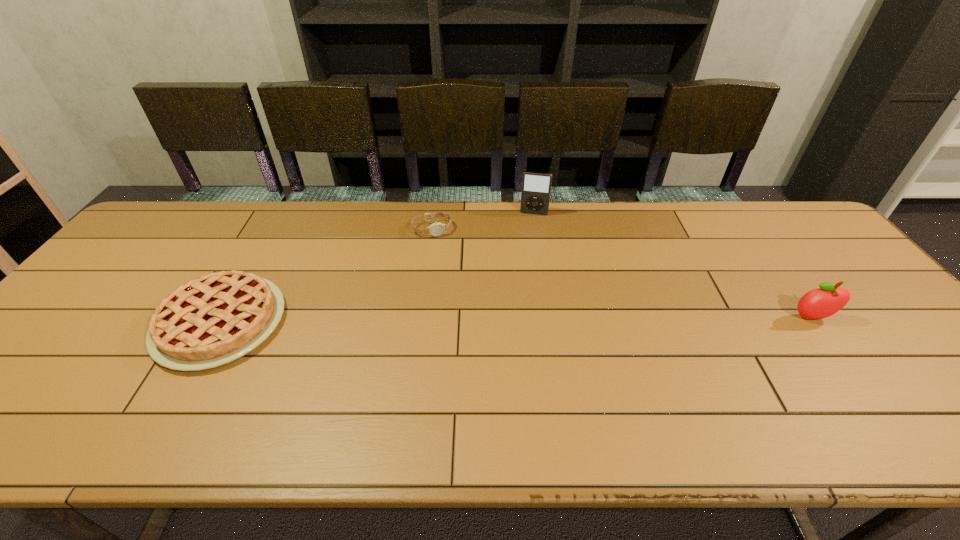
Where is `vacant position at the near edge of the desktop`? Image resolution: width=960 pixels, height=540 pixels. vacant position at the near edge of the desktop is located at coordinates (643, 380).

Locate an element on the screen. The image size is (960, 540). vacant area at the left edge is located at coordinates (71, 347).

Identify the location of blank area at the right edge. Image resolution: width=960 pixels, height=540 pixels. (848, 267).

Identify the location of vacant position at the far left corner of the desktop. This screenshot has width=960, height=540. (180, 239).

Identify the location of vacant space at the far right corner. (756, 211).

The height and width of the screenshot is (540, 960). I want to click on free area in between the tallest object and the second farthest object, so click(483, 221).

Find the location of a particular element. empty location between the pie and the rightmost object is located at coordinates (516, 320).

Find the location of a particular element. The height and width of the screenshot is (540, 960). vacant space that is in between the apple and the pie is located at coordinates (516, 320).

Find the location of `vacant area that lies between the third shortest object and the second farthest object`. vacant area that lies between the third shortest object and the second farthest object is located at coordinates (622, 273).

Locate an element on the screen. The height and width of the screenshot is (540, 960). free spot between the watch and the rightmost object is located at coordinates point(622,273).